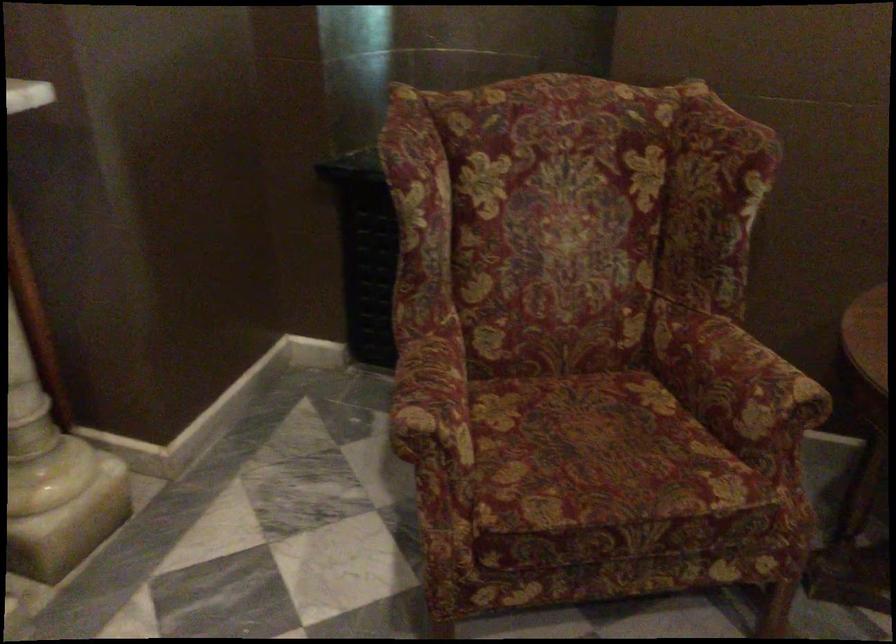
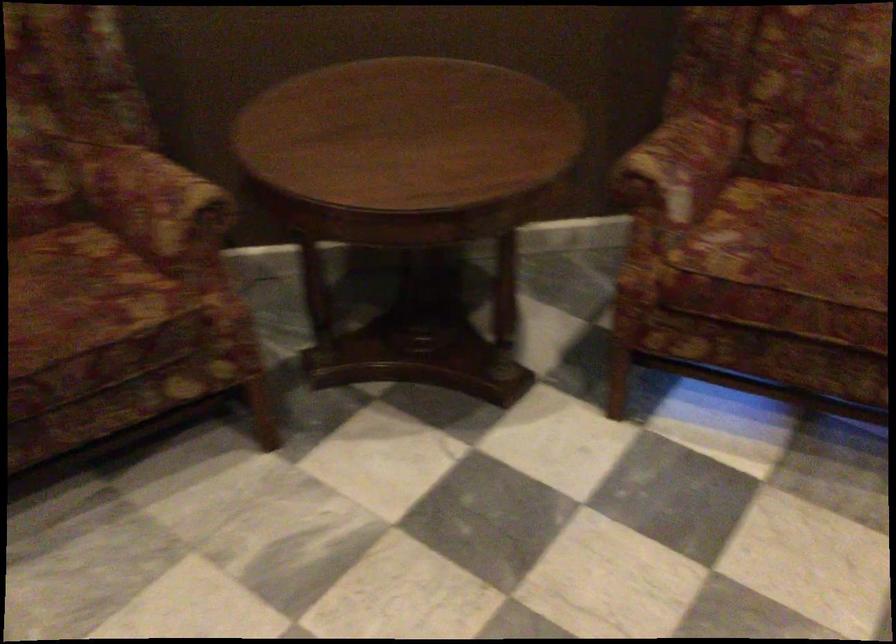
Where in the second image is the point corresponding to [743,381] from the first image?

(156, 204)